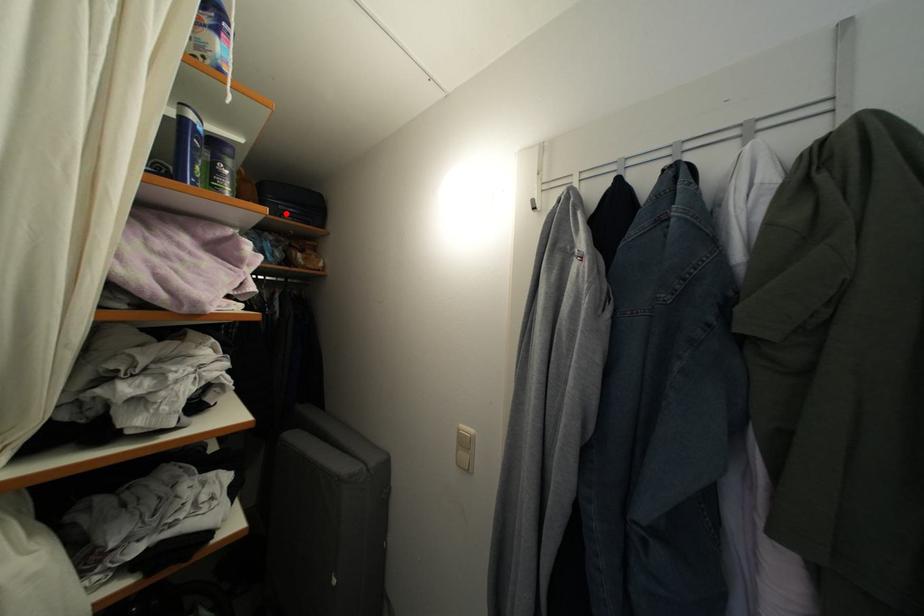
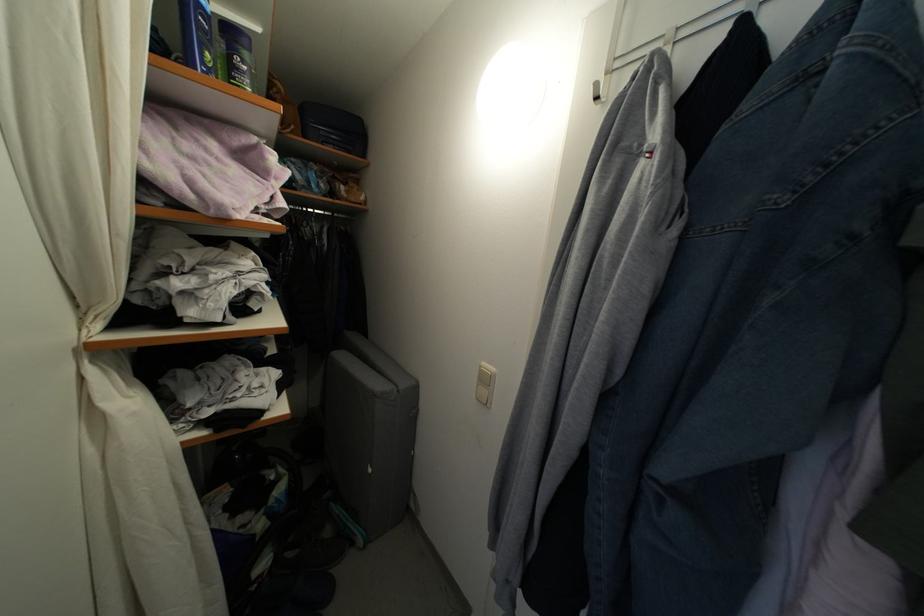
Where in the second image is the point corresponding to the highlighted location from the first image?

(327, 139)